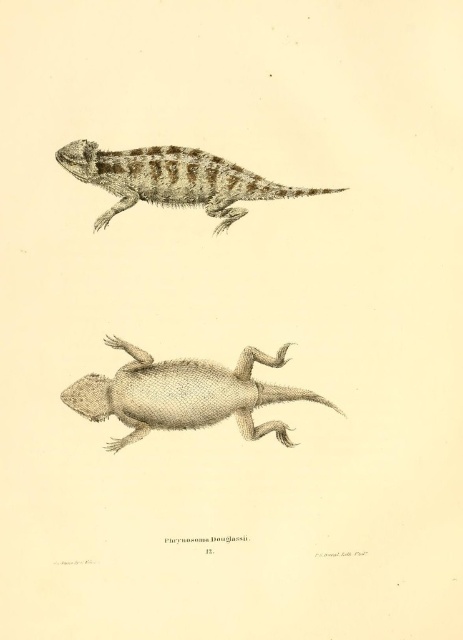
Question: Can you confirm if smooth beige lizard at center is positioned to the left of brown textured lizard at upper center?

Choices:
 (A) yes
 (B) no

Answer: (B)

Question: Does smooth beige lizard at center appear on the right side of brown textured lizard at upper center?

Choices:
 (A) no
 (B) yes

Answer: (B)

Question: Does smooth beige lizard at center have a smaller size compared to brown textured lizard at upper center?

Choices:
 (A) no
 (B) yes

Answer: (A)

Question: Which of the following is the closest to the observer?

Choices:
 (A) smooth beige lizard at center
 (B) brown textured lizard at upper center

Answer: (B)

Question: Which object appears closest to the camera in this image?

Choices:
 (A) smooth beige lizard at center
 (B) brown textured lizard at upper center

Answer: (B)